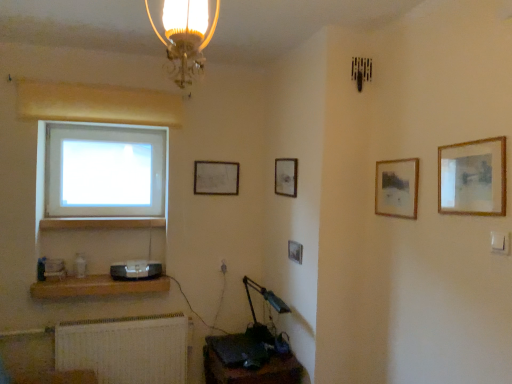
Identify the location of free location above wooden at lower left (from a real-world perspective). (93, 218).